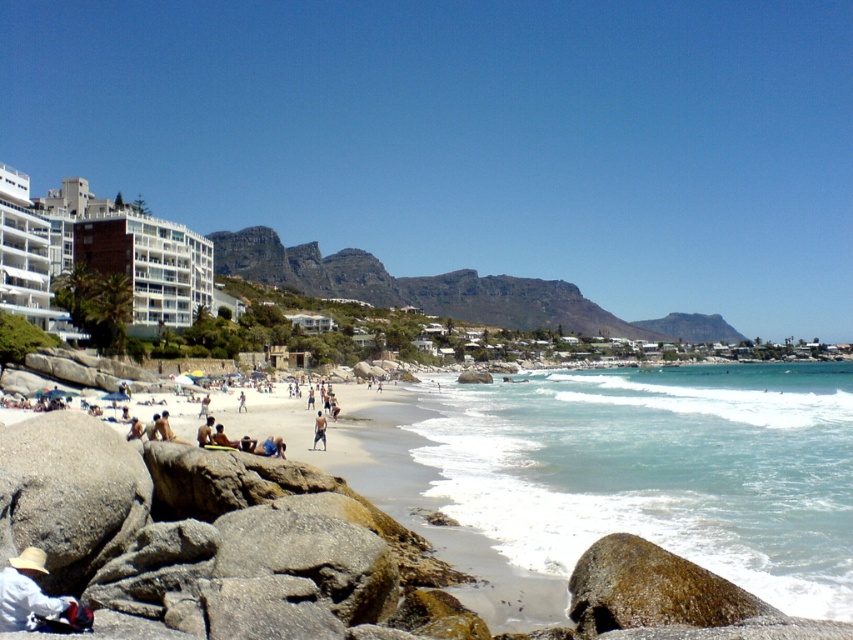
Question: Does tan skin human at center come in front of skinny man at center?

Choices:
 (A) yes
 (B) no

Answer: (A)

Question: Is white glossy building at upper left wider than skinny man at center?

Choices:
 (A) yes
 (B) no

Answer: (A)

Question: Which object appears farthest from the camera in this image?

Choices:
 (A) white glossy building at upper left
 (B) skinny man at center

Answer: (A)

Question: Which point is closer to the camera?

Choices:
 (A) gray rough boulder at lower left
 (B) skinny man at center
 (C) white cotton hat at lower left

Answer: (C)

Question: Is gray rough boulder at lower left smaller than tan skin human at center?

Choices:
 (A) yes
 (B) no

Answer: (A)

Question: Among these objects, which one is nearest to the camera?

Choices:
 (A) tan skin human at center
 (B) skinny man at center

Answer: (A)